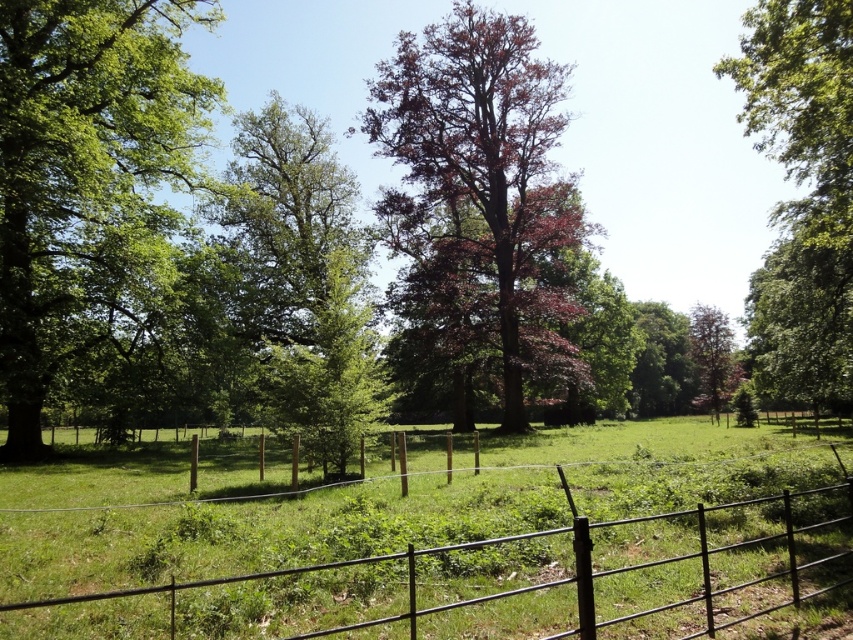
Question: Based on their relative distances, which object is farther from the purple-leaved tree at center?

Choices:
 (A) green leafy tree at center
 (B) green leafy tree at left

Answer: (B)

Question: Can you confirm if green leafy tree at left is bigger than green leafy tree at upper right?

Choices:
 (A) no
 (B) yes

Answer: (A)

Question: Which of the following is the closest to the observer?

Choices:
 (A) (712, 364)
 (B) (45, 125)
 (C) (456, 44)

Answer: (B)

Question: Which of these objects is positioned closest to the green leafy tree at left?

Choices:
 (A) green leafy tree at upper right
 (B) purple-leaved tree at right

Answer: (A)

Question: From the image, what is the correct spatial relationship of purple-leaved tree at center in relation to purple-leaved tree at right?

Choices:
 (A) left
 (B) right

Answer: (A)

Question: Can you confirm if green leafy tree at upper right is positioned below green leafy tree at center?

Choices:
 (A) no
 (B) yes

Answer: (A)